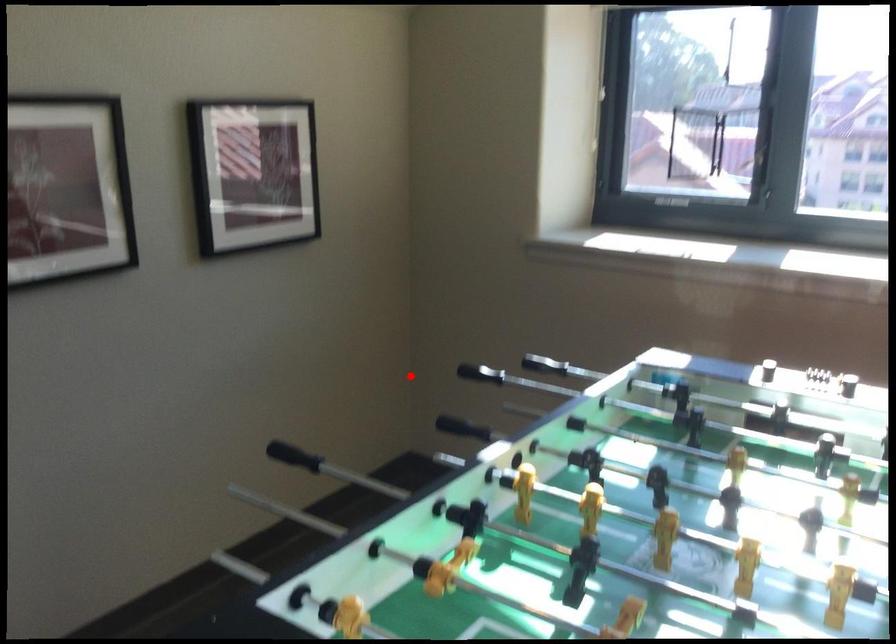
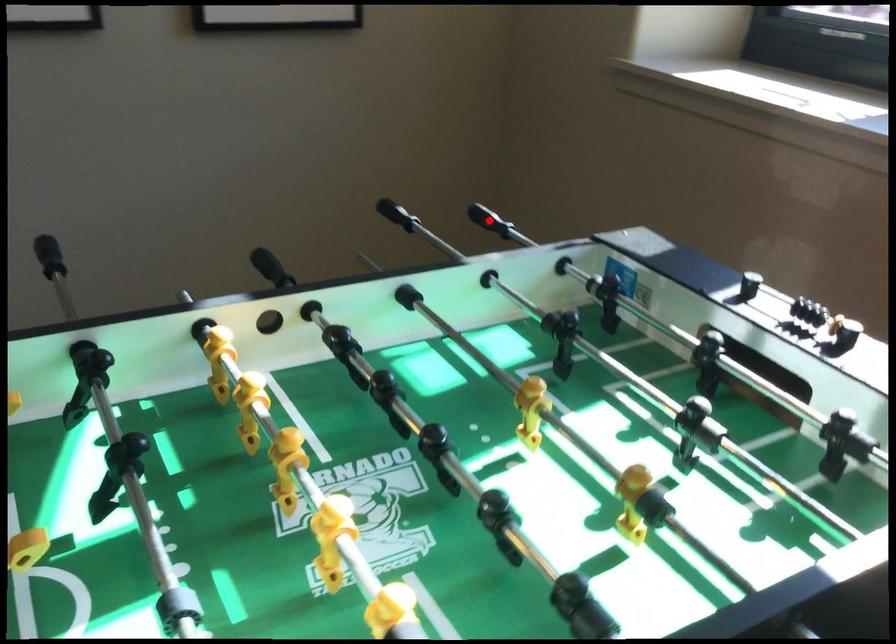
Consider the image. I am providing you with two images of the same scene from different viewpoints. A red point is marked on the first image and another point is marked on the second image. Is the red point in image1 aligned with the point shown in image2?

Yes